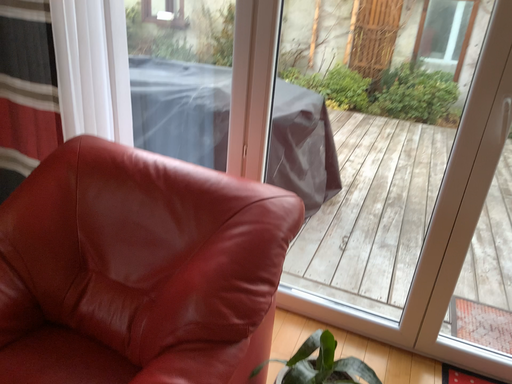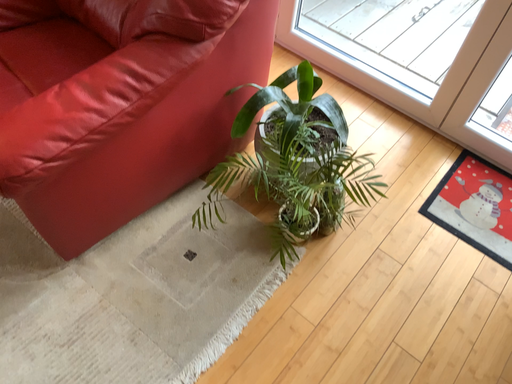
Question: How did the camera likely rotate when shooting the video?

Choices:
 (A) rotated right
 (B) rotated left

Answer: (B)